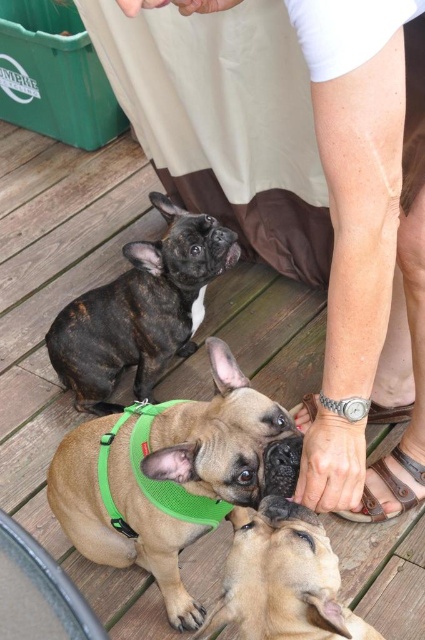
Question: Can you confirm if black fur dog at upper left is bigger than brown leather sandal at lower center?

Choices:
 (A) yes
 (B) no

Answer: (A)

Question: Which point is closer to the camera taking this photo?

Choices:
 (A) (408, 506)
 (B) (189, 252)

Answer: (A)

Question: Does black fur dog at upper left appear on the right side of brown mesh harness at center?

Choices:
 (A) yes
 (B) no

Answer: (B)

Question: Which object is the farthest from the black fur dog at upper left?

Choices:
 (A) skinny white leg at upper center
 (B) brown leather sandal at lower center
 (C) silver metallic sandal at lower center

Answer: (B)

Question: Does skinny white leg at upper center appear under brown leather sandal at lower center?

Choices:
 (A) no
 (B) yes

Answer: (A)

Question: Considering the real-world distances, which object is closest to the green mesh harness at center?

Choices:
 (A) black fur dog at upper left
 (B) silver metallic sandal at lower center
 (C) skinny white leg at upper center
 (D) brown mesh harness at center

Answer: (D)